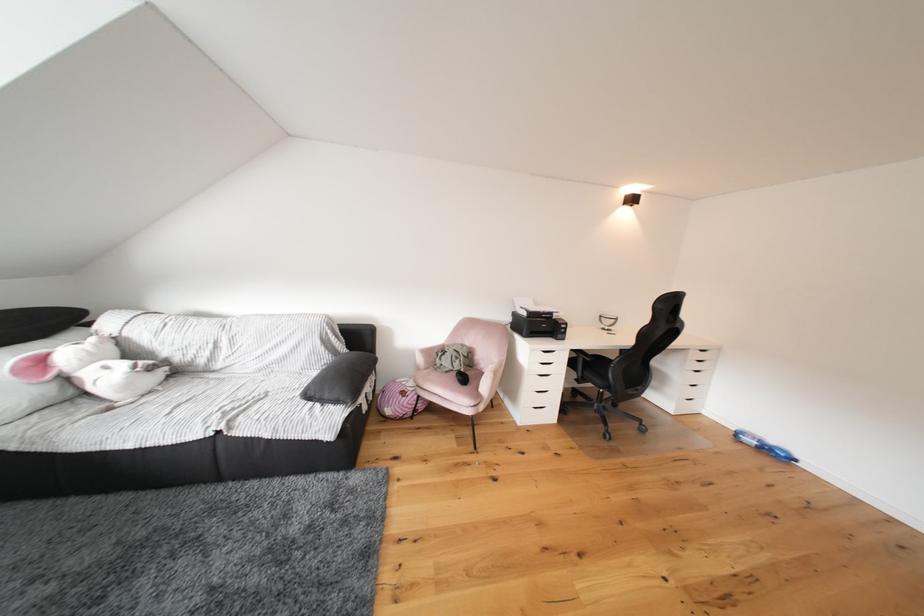
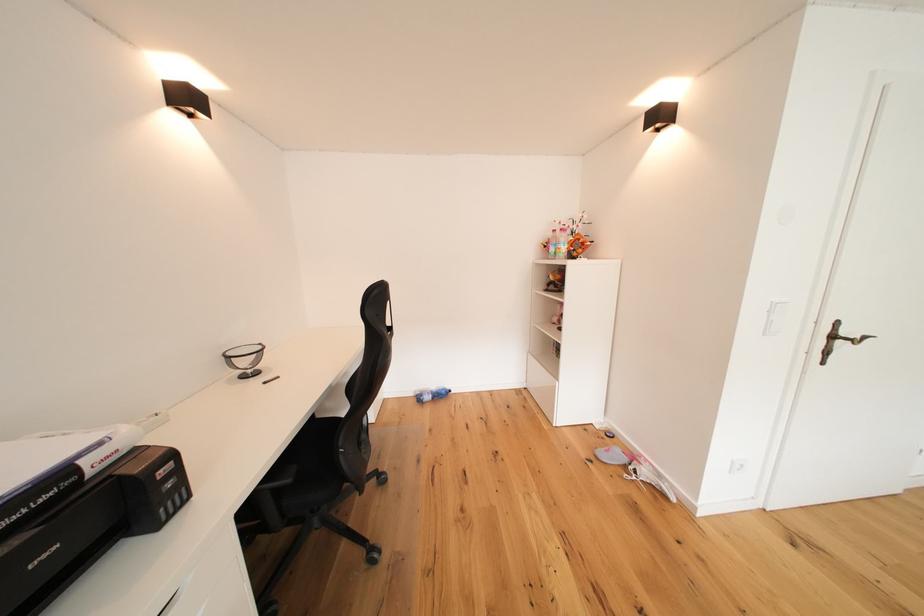
Where in the second image is the point corresponding to the point at 598,363 from the first image?

(298, 485)